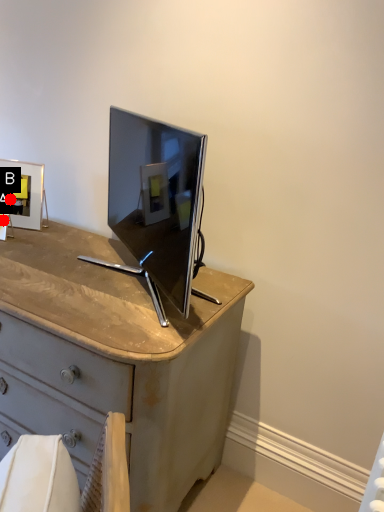
Question: Two points are circled on the image, labeled by A and B beside each circle. Which point is closer to the camera?

Choices:
 (A) A is closer
 (B) B is closer

Answer: (A)